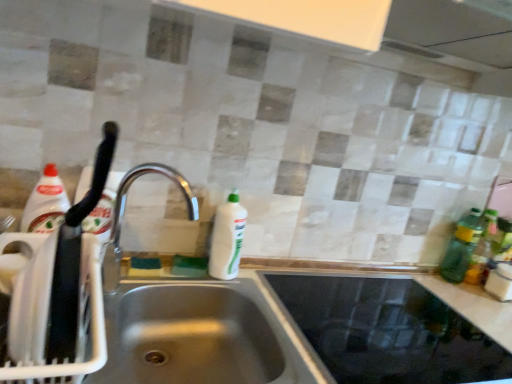
How much space does green plastic bottle at right, arranged as the 1th bottle when viewed from the right, occupy horizontally?

3.10 inches.

Image resolution: width=512 pixels, height=384 pixels. Describe the element at coordinates (227, 238) in the screenshot. I see `white glossy bottle at center` at that location.

Where is `green plastic bottle at right, arranged as the 1th bottle when viewed from the right`? This screenshot has width=512, height=384. green plastic bottle at right, arranged as the 1th bottle when viewed from the right is located at coordinates (482, 249).

From the image's perspective, is white plastic dish rack at left positioned above or below silver metallic faucet at center?

Based on their image positions, white plastic dish rack at left is located beneath silver metallic faucet at center.

Is white plastic dish rack at left beside silver metallic faucet at center?

No, white plastic dish rack at left is not making contact with silver metallic faucet at center.

Considering the relative sizes of white plastic dish rack at left and silver metallic faucet at center in the image provided, is white plastic dish rack at left thinner than silver metallic faucet at center?

No, white plastic dish rack at left is not thinner than silver metallic faucet at center.

From a real-world perspective, is white plastic dish rack at left on silver metallic faucet at center?

No, from a real-world perspective, white plastic dish rack at left is not over silver metallic faucet at center

Is silver metallic faucet at center bigger than white plastic dish rack at left?

Yes, silver metallic faucet at center is bigger than white plastic dish rack at left.

From a real-world perspective, is silver metallic faucet at center above or below white plastic dish rack at left?

In terms of real-world spatial position, silver metallic faucet at center is above white plastic dish rack at left.

Between point (106, 291) and point (50, 261), which one is positioned in front?

Positioned in front is point (50, 261).

Is white glossy bottle at center oriented towards satin steel sink at center?

No, white glossy bottle at center does not turn towards satin steel sink at center.

Between white glossy bottle at center and satin steel sink at center, which one is positioned in front?

satin steel sink at center is in front.

How different are the orientations of white glossy bottle at center and satin steel sink at center in degrees?

The angular difference between white glossy bottle at center and satin steel sink at center is 1.24 degrees.

Is white glossy bottle at center far from satin steel sink at center?

No, white glossy bottle at center is not far away from satin steel sink at center.

Is silver metallic faucet at center inside the boundaries of white glossy bottle at center, or outside?

silver metallic faucet at center is not enclosed by white glossy bottle at center.

From the picture: Which object is thinner, silver metallic faucet at center or white glossy bottle at center?

With smaller width is white glossy bottle at center.

Is silver metallic faucet at center turned away from white glossy bottle at center?

silver metallic faucet at center does not have its back to white glossy bottle at center.

Is silver metallic faucet at center far from white glossy bottle at center?

silver metallic faucet at center is near white glossy bottle at center, not far away.

Between white glossy bottle at center and silver metallic faucet at center, which one has larger width?

silver metallic faucet at center.

Would you say white glossy bottle at center is outside silver metallic faucet at center?

white glossy bottle at center is positioned outside silver metallic faucet at center.

Are white glossy bottle at center and silver metallic faucet at center beside each other?

No, white glossy bottle at center is not with silver metallic faucet at center.

Who is smaller, white glossy bottle at center or silver metallic faucet at center?

white glossy bottle at center.

Find the location of a particular element. This screenshot has width=512, height=384. cleaning product below the green translucent bottle at right, arranged as the 2th bottle when viewed from the right (from a real-world perspective) is located at coordinates (227, 238).

Which object is closer to the camera taking this photo, green translucent bottle at right, arranged as the 2th bottle when viewed from the right, or white glossy bottle at center?

white glossy bottle at center is more forward.

Which of these two, green translucent bottle at right, positioned as the 1th bottle in left-to-right order, or white glossy bottle at center, stands shorter?

white glossy bottle at center.

Considering the sizes of objects green translucent bottle at right, positioned as the 1th bottle in left-to-right order, and white glossy bottle at center in the image provided, who is wider, green translucent bottle at right, positioned as the 1th bottle in left-to-right order, or white glossy bottle at center?

white glossy bottle at center.

Does point (88, 273) appear closer or farther from the camera than point (465, 356)?

Clearly, point (88, 273) is closer to the camera than point (465, 356).

Is white plastic dish rack at left smaller than satin steel sink at center?

Yes.

Looking at this image, is white plastic dish rack at left not close to satin steel sink at center?

No, there isn't a large distance between white plastic dish rack at left and satin steel sink at center.

From a real-world perspective, which object rests below the other?

In real-world perspective, satin steel sink at center is lower.

Where is `tap that appears above the white plastic dish rack at left (from a real-world perspective)`? The height and width of the screenshot is (384, 512). tap that appears above the white plastic dish rack at left (from a real-world perspective) is located at coordinates (123, 216).

You are a GUI agent. You are given a task and a screenshot of the screen. Output one action in this format:
    pyautogui.click(x=<x>, y=<y>)
    Task: Click on the tap that appears above the white plastic dish rack at left (from the image's perspective)
    
    Given the screenshot: What is the action you would take?
    pyautogui.click(x=123, y=216)

Consider the image. Which object lies nearer to the anchor point white plastic dish rack at left, satin steel sink at center or silver metallic faucet at center?

silver metallic faucet at center.

Based on their spatial positions, is stainless steel sink at lower left or satin steel sink at center closer to green plastic bottle at right, arranged as the 2th bottle when viewed from the left?

Among the two, satin steel sink at center is located nearer to green plastic bottle at right, arranged as the 2th bottle when viewed from the left.

When comparing their distances from white glossy bottle at center, does stainless steel sink at lower left or silver metallic faucet at center seem further?

stainless steel sink at lower left lies further to white glossy bottle at center than the other object.

Considering their positions, is green plastic bottle at right, arranged as the 2th bottle when viewed from the left, positioned closer to white plastic dish rack at left than silver metallic faucet at center?

silver metallic faucet at center lies closer to white plastic dish rack at left than the other object.

Estimate the real-world distances between objects in this image. Which object is further from white plastic dish rack at left, stainless steel sink at lower left or green translucent bottle at right, arranged as the 2th bottle when viewed from the right?

green translucent bottle at right, arranged as the 2th bottle when viewed from the right, lies further to white plastic dish rack at left than the other object.

Which object lies further to the anchor point stainless steel sink at lower left, white glossy bottle at center or green translucent bottle at right, arranged as the 2th bottle when viewed from the right?

green translucent bottle at right, arranged as the 2th bottle when viewed from the right, is further to stainless steel sink at lower left.

Looking at the image, which one is located further to green translucent bottle at right, arranged as the 2th bottle when viewed from the right, white glossy bottle at center or white plastic dish rack at left?

white plastic dish rack at left is positioned further to the anchor green translucent bottle at right, arranged as the 2th bottle when viewed from the right.

When comparing their distances from green plastic bottle at right, arranged as the 2th bottle when viewed from the left, does white plastic dish rack at left or white glossy bottle at center seem closer?

white glossy bottle at center lies closer to green plastic bottle at right, arranged as the 2th bottle when viewed from the left, than the other object.

I want to click on sink located between silver metallic faucet at center and green translucent bottle at right, positioned as the 1th bottle in left-to-right order, in the left-right direction, so tap(196, 335).

The image size is (512, 384). I want to click on counter top between silver metallic faucet at center and green translucent bottle at right, positioned as the 1th bottle in left-to-right order, from left to right, so click(x=291, y=332).

Where is `sink between silver metallic faucet at center and satin steel sink at center in the horizontal direction`? sink between silver metallic faucet at center and satin steel sink at center in the horizontal direction is located at coordinates (196, 335).

I want to click on sink between white plastic dish rack at left and green translucent bottle at right, positioned as the 1th bottle in left-to-right order, in the horizontal direction, so click(x=196, y=335).